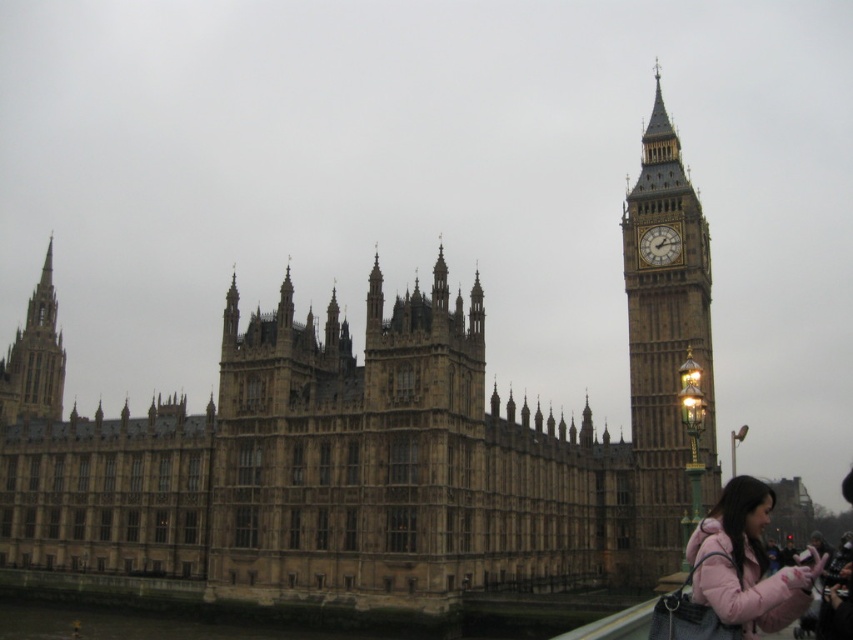
Question: Which of the following is the farthest from the observer?

Choices:
 (A) pink fleece jacket at lower right
 (B) brown stone clock tower at right

Answer: (B)

Question: Among these points, which one is farthest from the camera?

Choices:
 (A) (674, 237)
 (B) (38, 291)
 (C) (650, 566)

Answer: (B)

Question: Which point is farther to the camera?

Choices:
 (A) (57, 372)
 (B) (651, 257)
 (C) (653, 342)

Answer: (A)

Question: Does brown stone clock tower at right appear over pink fleece jacket at lower right?

Choices:
 (A) no
 (B) yes

Answer: (B)

Question: Does brown stone clock tower at right appear under brown stone spire at left?

Choices:
 (A) no
 (B) yes

Answer: (A)

Question: Is brown stone clock tower at right to the left of golden stone clock at upper right from the viewer's perspective?

Choices:
 (A) no
 (B) yes

Answer: (B)